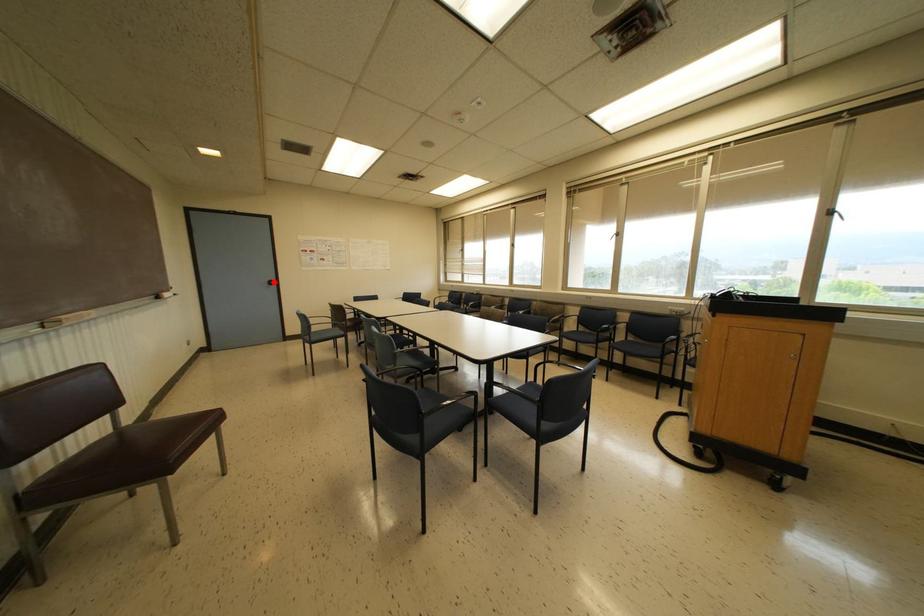
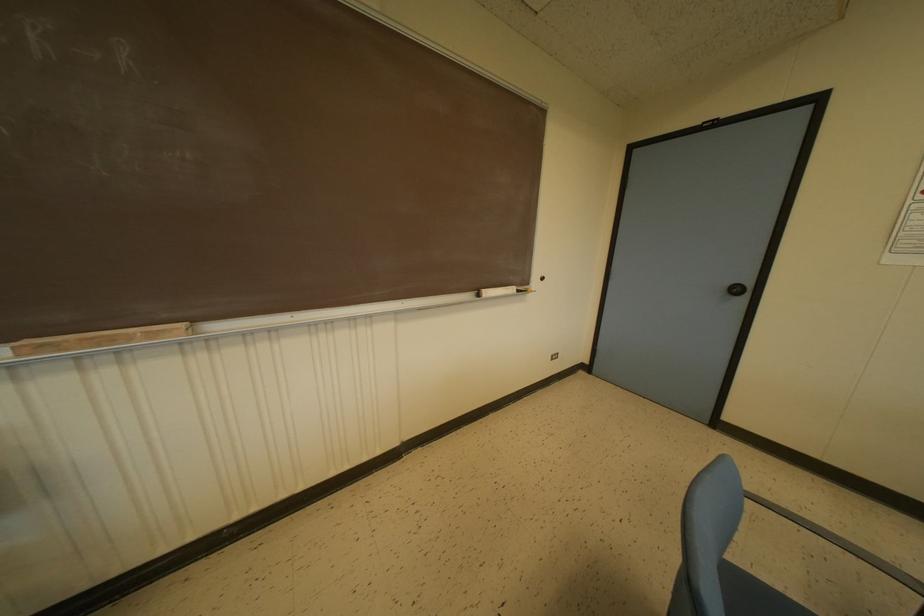
In the second image, find the point that corresponds to the highlighted location in the first image.

(746, 291)